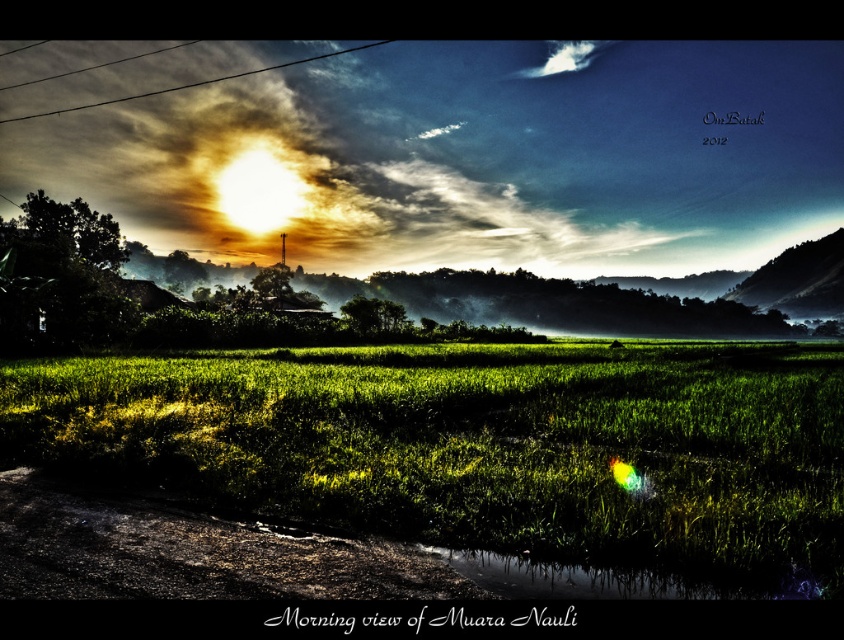
Measure the distance from green grass at center to metallic wire at upper left.

A distance of 276.25 meters exists between green grass at center and metallic wire at upper left.

Is green grass at center bigger than metallic wire at upper left?

No, green grass at center is not bigger than metallic wire at upper left.

Identify the location of green grass at center. (474, 442).